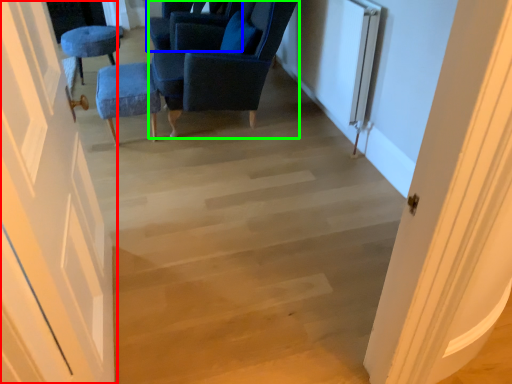
Question: Which is farther away from door (highlighted by a red box)? chair (highlighted by a blue box) or chair (highlighted by a green box)?

Choices:
 (A) chair
 (B) chair

Answer: (A)